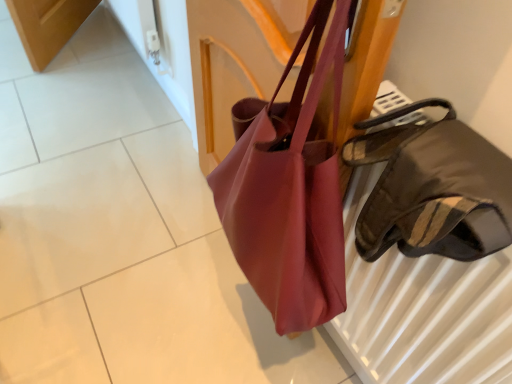
Question: From the image's perspective, is matte pink tote at center, the second handbag when ordered from right to left, beneath matte pink fabric bag at center?

Choices:
 (A) no
 (B) yes

Answer: (A)

Question: Is matte pink tote at center, the second handbag when ordered from right to left, at the right side of matte pink fabric bag at center?

Choices:
 (A) no
 (B) yes

Answer: (B)

Question: From a real-world perspective, is matte pink tote at center, the second handbag in the front-to-back sequence, located higher than matte pink fabric bag at center?

Choices:
 (A) no
 (B) yes

Answer: (B)

Question: Is matte pink fabric bag at center located within matte pink tote at center, the second handbag when ordered from right to left?

Choices:
 (A) yes
 (B) no

Answer: (B)

Question: Considering the relative positions of matte pink tote at center, the second handbag when ordered from right to left, and matte pink fabric bag at center in the image provided, is matte pink tote at center, the second handbag when ordered from right to left, behind matte pink fabric bag at center?

Choices:
 (A) no
 (B) yes

Answer: (A)

Question: Do you think matte pink fabric bag at center is within satin brown handbag at right, marked as the second handbag in a left-to-right arrangement, or outside of it?

Choices:
 (A) outside
 (B) inside

Answer: (A)

Question: From the image's perspective, is matte pink fabric bag at center positioned above or below satin brown handbag at right, marked as the 1th handbag in a front-to-back arrangement?

Choices:
 (A) below
 (B) above

Answer: (A)

Question: Considering the positions of matte pink fabric bag at center and satin brown handbag at right, positioned as the 1th handbag in right-to-left order, in the image, is matte pink fabric bag at center taller or shorter than satin brown handbag at right, positioned as the 1th handbag in right-to-left order,?

Choices:
 (A) short
 (B) tall

Answer: (A)

Question: Looking at their shapes, would you say matte pink fabric bag at center is wider or thinner than satin brown handbag at right, marked as the second handbag in a left-to-right arrangement?

Choices:
 (A) thin
 (B) wide

Answer: (B)

Question: From the image's perspective, relative to matte pink fabric bag at center, is matte pink tote at center, the second handbag in the front-to-back sequence, above or below?

Choices:
 (A) above
 (B) below

Answer: (A)

Question: From their relative heights in the image, would you say matte pink tote at center, the second handbag in the front-to-back sequence, is taller or shorter than matte pink fabric bag at center?

Choices:
 (A) tall
 (B) short

Answer: (A)

Question: Is matte pink tote at center, the second handbag in the front-to-back sequence, inside or outside of matte pink fabric bag at center?

Choices:
 (A) inside
 (B) outside

Answer: (B)

Question: Is matte pink tote at center, marked as the 1th handbag in a left-to-right arrangement, bigger or smaller than matte pink fabric bag at center?

Choices:
 (A) big
 (B) small

Answer: (A)

Question: Considering the positions of satin brown handbag at right, which appears as the 2th handbag when viewed from the back, and matte pink tote at center, the first handbag positioned from the back, in the image, is satin brown handbag at right, which appears as the 2th handbag when viewed from the back, taller or shorter than matte pink tote at center, the first handbag positioned from the back,?

Choices:
 (A) tall
 (B) short

Answer: (B)

Question: Considering the positions of satin brown handbag at right, marked as the 1th handbag in a front-to-back arrangement, and matte pink tote at center, marked as the 1th handbag in a left-to-right arrangement, in the image, is satin brown handbag at right, marked as the 1th handbag in a front-to-back arrangement, bigger or smaller than matte pink tote at center, marked as the 1th handbag in a left-to-right arrangement,?

Choices:
 (A) small
 (B) big

Answer: (A)